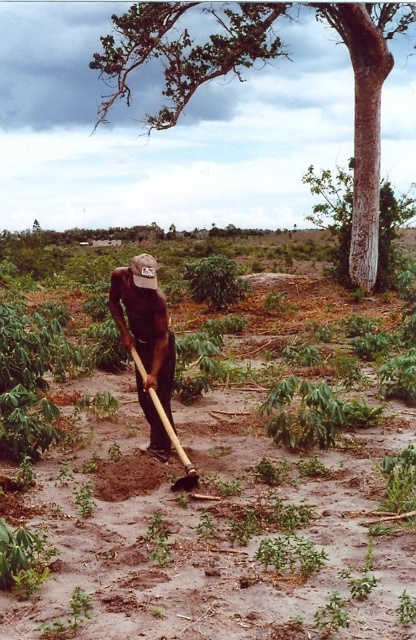
Question: Which point is farther to the camera?

Choices:
 (A) (119, 54)
 (B) (195, 477)

Answer: (A)

Question: Which is farther from the smooth bark tree at upper center?

Choices:
 (A) wooden shovel at center
 (B) dark skin wood hoe at center

Answer: (B)

Question: Does smooth bark tree at upper center come behind dark skin wood hoe at center?

Choices:
 (A) no
 (B) yes

Answer: (B)

Question: Where is smooth bark tree at upper center located in relation to wooden shovel at center in the image?

Choices:
 (A) right
 (B) left

Answer: (A)

Question: Which object is positioned closest to the smooth bark tree at upper center?

Choices:
 (A) wooden shovel at center
 (B) dark skin wood hoe at center

Answer: (A)

Question: Can you confirm if smooth bark tree at upper center is positioned below wooden shovel at center?

Choices:
 (A) yes
 (B) no

Answer: (B)